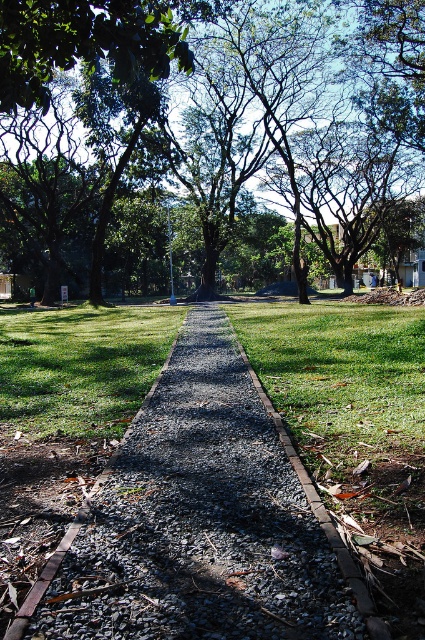
You are a gardener who needs to mow the grass along the path. The gray gravel at center and the green leafy tree at center are in your way. Which object is taller and needs to be considered for safety when operating the mower?

The green leafy tree at center is taller than the gray gravel at center, so you should be cautious of the green leafy tree at center to avoid damaging it or the mower.

From the picture: You are a gardener planning to plant a new flower bed along the gray gravel at center. Considering the green leafy tree at center, what potential issue should you be aware of?

The gray gravel at center is positioned under the green leafy tree at center, so planting flowers there may be challenging due to limited sunlight reaching the ground beneath the tree.